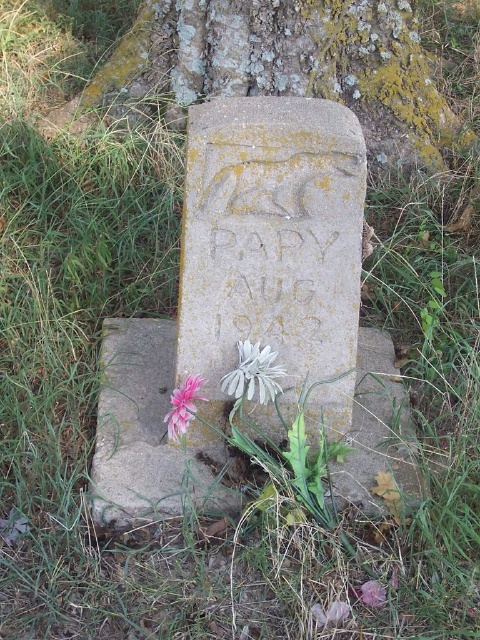
Question: Does green mossy stone at center have a smaller size compared to pink matte flower at lower left?

Choices:
 (A) no
 (B) yes

Answer: (A)

Question: Which object is farther from the camera taking this photo?

Choices:
 (A) stone at center
 (B) green mossy stone at center
 (C) white matte flower at center
 (D) pink matte flower at lower left

Answer: (B)

Question: Which object appears farthest from the camera in this image?

Choices:
 (A) pink matte flower at lower left
 (B) stone at center

Answer: (A)

Question: Does green mossy stone at center have a larger size compared to pink matte flower at lower left?

Choices:
 (A) yes
 (B) no

Answer: (A)

Question: Can you confirm if stone at center is positioned above white matte flower at center?

Choices:
 (A) yes
 (B) no

Answer: (B)

Question: Which point is closer to the camera?

Choices:
 (A) (229, 49)
 (B) (187, 397)
 (C) (272, 356)
 (D) (179, 456)

Answer: (B)